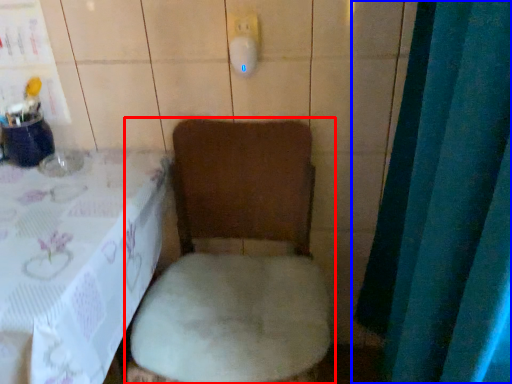
Question: Which object is further to the camera taking this photo, toilet (highlighted by a red box) or curtain (highlighted by a blue box)?

Choices:
 (A) toilet
 (B) curtain

Answer: (A)